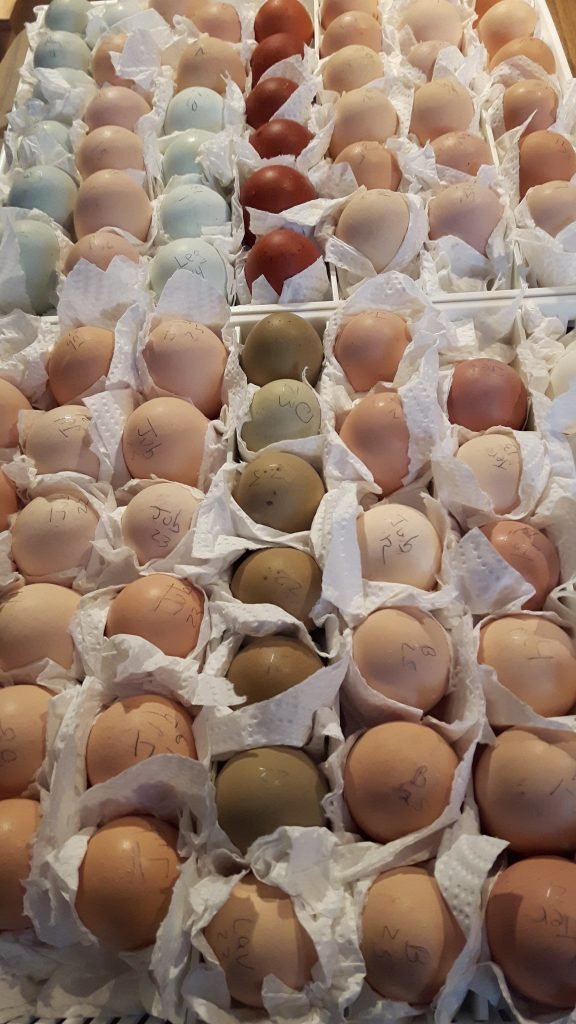
Where is `table top right of eggs`? The width and height of the screenshot is (576, 1024). table top right of eggs is located at coordinates (564, 22).